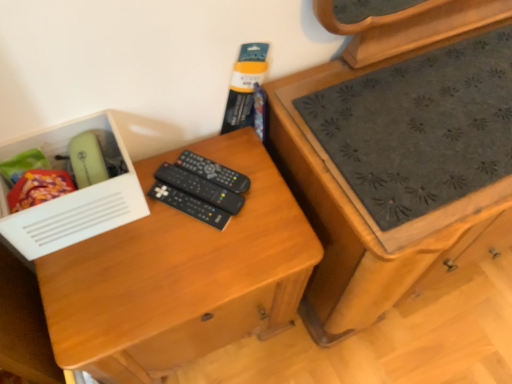
Find the location of a particular element. Image resolution: width=512 pixels, height=384 pixels. free space behind black plastic remote controls at center, which is the 2th remote control from top to bottom is located at coordinates (219, 150).